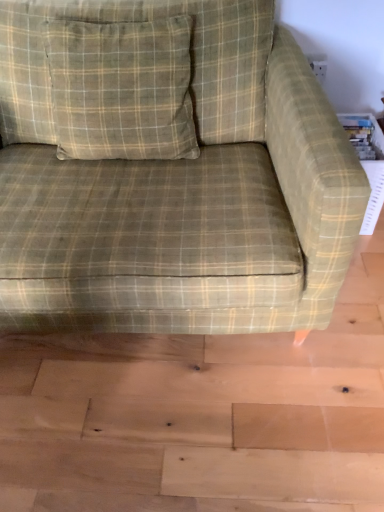
This screenshot has height=512, width=384. Describe the element at coordinates (168, 170) in the screenshot. I see `green plaid fabric couch at center` at that location.

Measure the distance between green plaid fabric couch at center and camera.

green plaid fabric couch at center and camera are 33.76 inches apart.

Identify the location of green plaid fabric couch at center. click(x=168, y=170).

You are a GUI agent. You are given a task and a screenshot of the screen. Output one action in this format:
    pyautogui.click(x=<x>, y=<y>)
    Task: Click on the green plaid pillow at upper left
    The height and width of the screenshot is (512, 384).
    Given the screenshot: What is the action you would take?
    pyautogui.click(x=122, y=89)

The height and width of the screenshot is (512, 384). Describe the element at coordinates (122, 89) in the screenshot. I see `green plaid pillow at upper left` at that location.

Measure the distance between green plaid pillow at upper left and camera.

green plaid pillow at upper left is 3.98 feet from camera.

You are a GUI agent. You are given a task and a screenshot of the screen. Output one action in this format:
    pyautogui.click(x=<x>, y=<y>)
    Task: Click on the green plaid fabric couch at center
    The height and width of the screenshot is (512, 384).
    Given the screenshot: What is the action you would take?
    pyautogui.click(x=168, y=170)

Is green plaid fabric couch at center to the left or to the right of green plaid pillow at upper left in the image?

In the image, green plaid fabric couch at center appears on the right side of green plaid pillow at upper left.

Looking at this image, is the depth of green plaid fabric couch at center less than that of green plaid pillow at upper left?

Yes, it is in front of green plaid pillow at upper left.

Between point (66, 58) and point (186, 98), which one is positioned behind?

The point (186, 98) is more distant.

From the image's perspective, does green plaid fabric couch at center appear lower than green plaid pillow at upper left?

Yes.

From the picture: From a real-world perspective, which is physically above, green plaid fabric couch at center or green plaid pillow at upper left?

green plaid pillow at upper left.

From the picture: Is green plaid fabric couch at center wider or thinner than green plaid pillow at upper left?

In the image, green plaid fabric couch at center appears to be wider than green plaid pillow at upper left.

Is green plaid fabric couch at center shorter than green plaid pillow at upper left?

No, green plaid fabric couch at center is not shorter than green plaid pillow at upper left.

Between green plaid fabric couch at center and green plaid pillow at upper left, which one has larger size?

green plaid fabric couch at center is bigger.

Would you say green plaid fabric couch at center is inside or outside green plaid pillow at upper left?

green plaid fabric couch at center is spatially situated outside green plaid pillow at upper left.

Is green plaid fabric couch at center far from green plaid pillow at upper left?

Actually, green plaid fabric couch at center and green plaid pillow at upper left are a little close together.

Is green plaid fabric couch at center aimed at green plaid pillow at upper left?

Yes, green plaid fabric couch at center is turned towards green plaid pillow at upper left.

What's the angular difference between green plaid fabric couch at center and green plaid pillow at upper left's facing directions?

There is a 4.15-degree angle between the facing directions of green plaid fabric couch at center and green plaid pillow at upper left.

How much distance is there between green plaid fabric couch at center and green plaid pillow at upper left?

green plaid fabric couch at center is 6.69 inches from green plaid pillow at upper left.

I want to click on studio couch that appears below the green plaid pillow at upper left (from a real-world perspective), so click(x=168, y=170).

Considering the relative positions of green plaid pillow at upper left and green plaid fabric couch at center in the image provided, is green plaid pillow at upper left to the left of green plaid fabric couch at center from the viewer's perspective?

Correct, you'll find green plaid pillow at upper left to the left of green plaid fabric couch at center.

Based on the photo, which is in front, green plaid pillow at upper left or green plaid fabric couch at center?

Positioned in front is green plaid fabric couch at center.

Is point (174, 46) positioned after point (230, 315)?

Yes, point (174, 46) is farther from viewer.

From the image's perspective, is green plaid pillow at upper left below green plaid fabric couch at center?

No, from the image's perspective, green plaid pillow at upper left is not below green plaid fabric couch at center.

Consider the image. From a real-world perspective, who is located higher, green plaid pillow at upper left or green plaid fabric couch at center?

green plaid pillow at upper left is physically above.

Can you confirm if green plaid pillow at upper left is thinner than green plaid fabric couch at center?

Yes, green plaid pillow at upper left is thinner than green plaid fabric couch at center.

Does green plaid pillow at upper left have a lesser height compared to green plaid fabric couch at center?

Yes, green plaid pillow at upper left is shorter than green plaid fabric couch at center.

Is green plaid pillow at upper left bigger than green plaid fabric couch at center?

Actually, green plaid pillow at upper left might be smaller than green plaid fabric couch at center.

Would you say green plaid pillow at upper left is inside or outside green plaid fabric couch at center?

green plaid pillow at upper left is spatially positioned inside green plaid fabric couch at center.

Is green plaid pillow at upper left in contact with green plaid fabric couch at center?

No, green plaid pillow at upper left is not touching green plaid fabric couch at center.

In the scene shown: Is green plaid pillow at upper left oriented towards green plaid fabric couch at center?

Yes, green plaid pillow at upper left is turned towards green plaid fabric couch at center.

How distant is green plaid pillow at upper left from green plaid fabric couch at center?

A distance of 6.69 inches exists between green plaid pillow at upper left and green plaid fabric couch at center.

I want to click on studio couch located in front of the green plaid pillow at upper left, so click(168, 170).

Where is `studio couch in front of the green plaid pillow at upper left`? This screenshot has height=512, width=384. studio couch in front of the green plaid pillow at upper left is located at coordinates (168, 170).

This screenshot has width=384, height=512. Identify the location of throw pillow above the green plaid fabric couch at center (from the image's perspective). (122, 89).